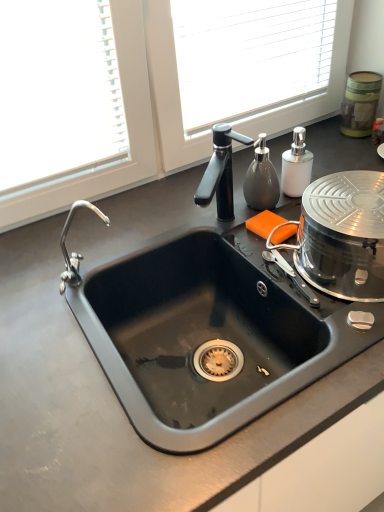
Find the location of `vacant area that is in front of white matte soap dispenser at upper right`. vacant area that is in front of white matte soap dispenser at upper right is located at coordinates (284, 224).